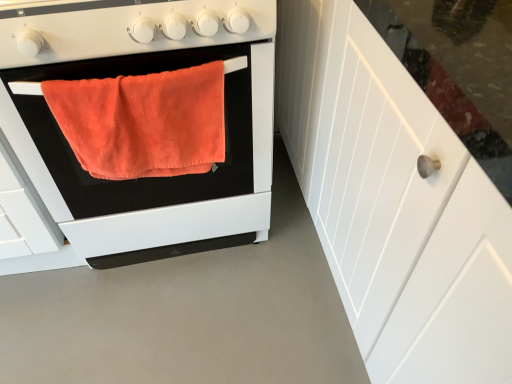
Question: Is orange plush towel at center far from white wood cabinet at right?

Choices:
 (A) no
 (B) yes

Answer: (A)

Question: From a real-world perspective, is orange plush towel at center located beneath white wood cabinet at right?

Choices:
 (A) no
 (B) yes

Answer: (A)

Question: Is orange plush towel at center to the right of white wood cabinet at right from the viewer's perspective?

Choices:
 (A) yes
 (B) no

Answer: (B)

Question: Could you tell me if orange plush towel at center is turned towards white wood cabinet at right?

Choices:
 (A) no
 (B) yes

Answer: (A)

Question: Can you confirm if orange plush towel at center is taller than white wood cabinet at right?

Choices:
 (A) yes
 (B) no

Answer: (B)

Question: Does point (271, 8) appear closer or farther from the camera than point (184, 39)?

Choices:
 (A) closer
 (B) farther

Answer: (B)

Question: Looking at their shapes, would you say matte white gas stove at center is wider or thinner than orange fabric towel at left?

Choices:
 (A) thin
 (B) wide

Answer: (A)

Question: From the image's perspective, is matte white gas stove at center above or below orange fabric towel at left?

Choices:
 (A) above
 (B) below

Answer: (A)

Question: Is matte white gas stove at center to the left or to the right of orange fabric towel at left in the image?

Choices:
 (A) right
 (B) left

Answer: (A)

Question: From the image's perspective, is orange plush towel at center above or below matte white gas stove at center?

Choices:
 (A) below
 (B) above

Answer: (A)

Question: Looking at their shapes, would you say orange plush towel at center is wider or thinner than matte white gas stove at center?

Choices:
 (A) thin
 (B) wide

Answer: (A)

Question: From a real-world perspective, is orange plush towel at center above or below matte white gas stove at center?

Choices:
 (A) below
 (B) above

Answer: (A)

Question: Considering the positions of orange plush towel at center and matte white gas stove at center in the image, is orange plush towel at center taller or shorter than matte white gas stove at center?

Choices:
 (A) short
 (B) tall

Answer: (B)

Question: From the image's perspective, is orange fabric towel at left above or below orange plush towel at center?

Choices:
 (A) above
 (B) below

Answer: (A)

Question: Is orange fabric towel at left bigger or smaller than orange plush towel at center?

Choices:
 (A) small
 (B) big

Answer: (B)